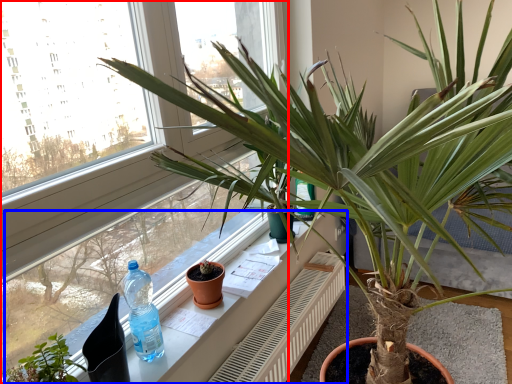
Question: Which of the following is the farthest to the observer, window (highlighted by a red box) or window sill (highlighted by a blue box)?

Choices:
 (A) window
 (B) window sill

Answer: (B)